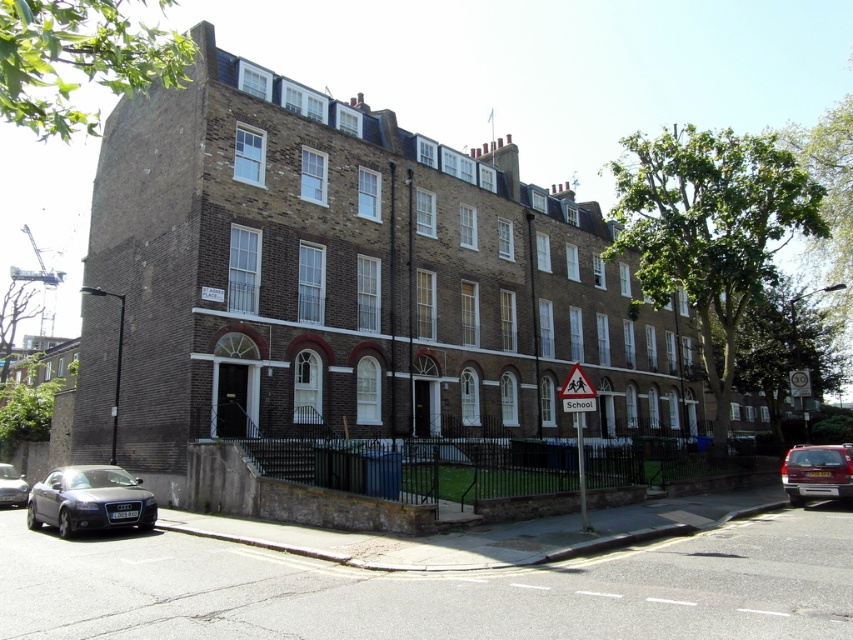
You are a visitor arriving at the school and see the white plastic triangular at center and the shiny silver car at lower left. Which object is closer to the entrance of the building?

The shiny silver car at lower left is closer to the entrance of the building because the white plastic triangular at center is positioned on the right side of it, implying the car is nearer to the entrance.

You are a pedestrian standing at the entrance of the building and see the metallic red car at lower right and the white plastic school sign at lower right. Which object is closer to you?

The metallic red car at lower right is smaller than the white plastic school sign at lower right. Since objects closer to the viewer appear smaller, this indicates that the metallic red car at lower right is actually farther away from you compared to the white plastic school sign at lower right. Therefore, the white plastic school sign at lower right is closer to you.

You are a delivery person who needs to park your metallic red car at lower right near the white plastic triangular at center. Given that the parking space is exactly 30 feet long, can your car fit without needing to adjust its position?

The metallic red car at lower right is 35.23 feet from the white plastic triangular at center, which means the car is longer than the parking space. Therefore, it cannot fit without adjusting its position.